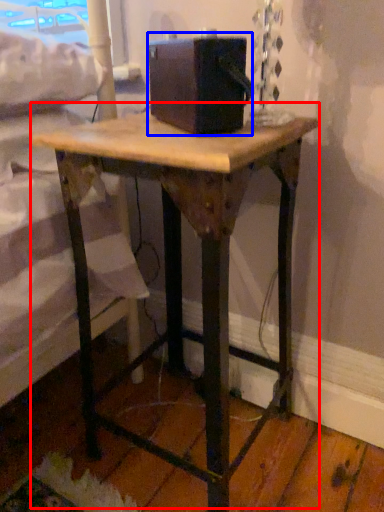
Question: Which of the following is the closest to the observer, table (highlighted by a red box) or box (highlighted by a blue box)?

Choices:
 (A) table
 (B) box

Answer: (A)